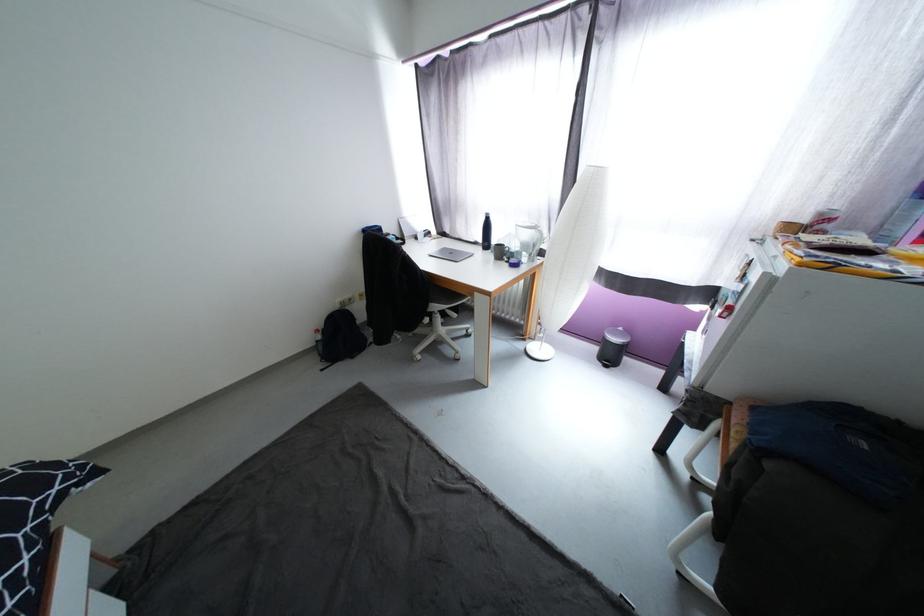
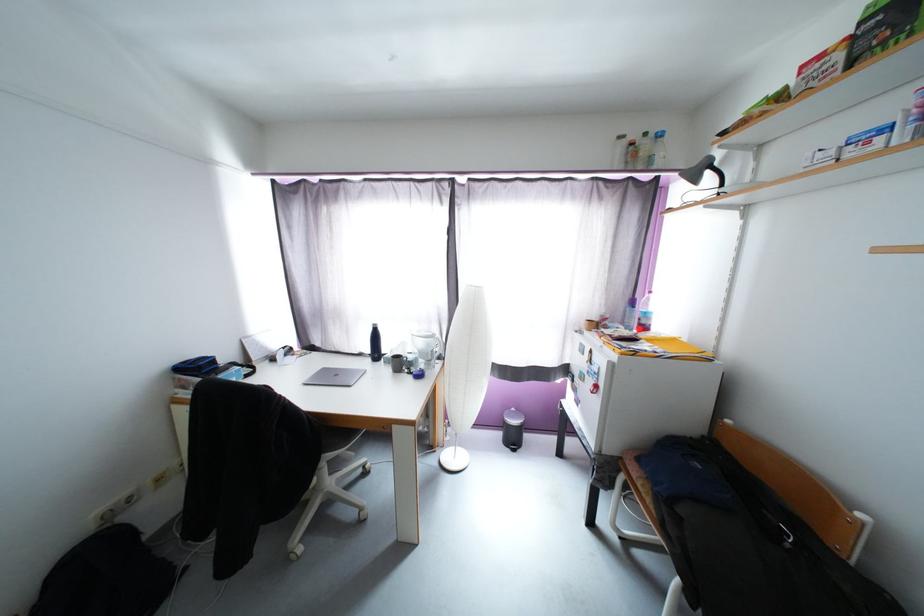
In the second image, find the point that corresponds to [490,220] in the first image.

(377, 331)